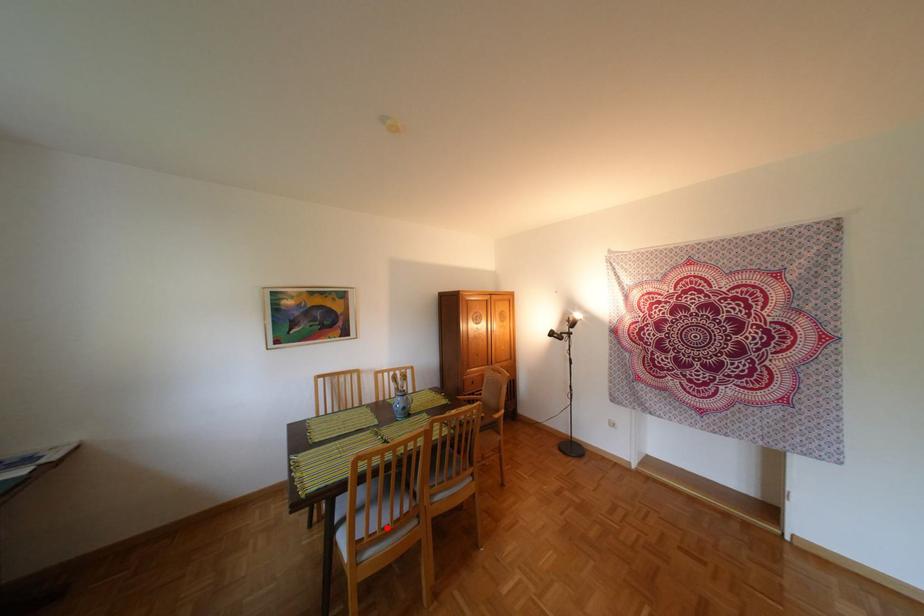
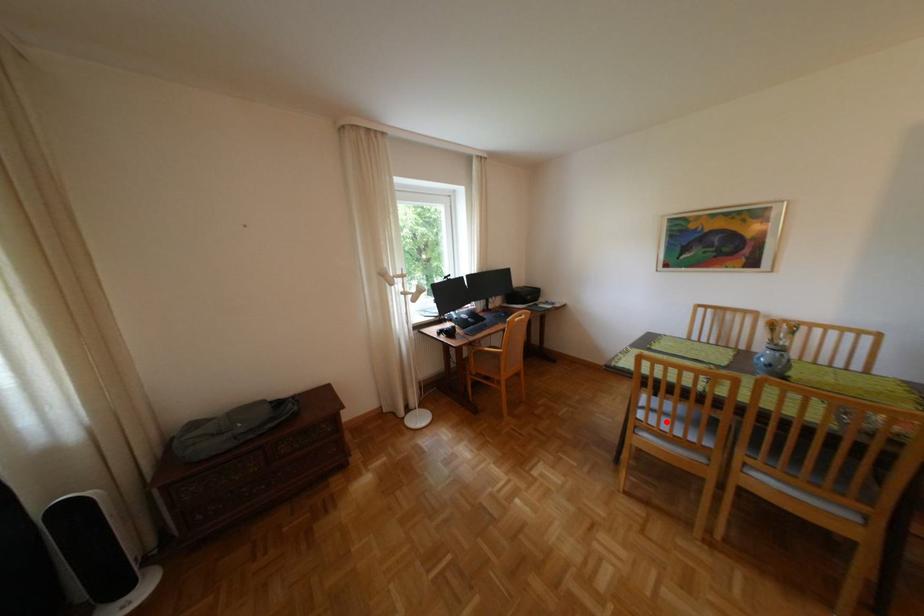
I am providing you with two images of the same scene from different viewpoints. A red point is marked on the first image and another point is marked on the second image. Is the red point in image1 aligned with the point shown in image2?

Yes